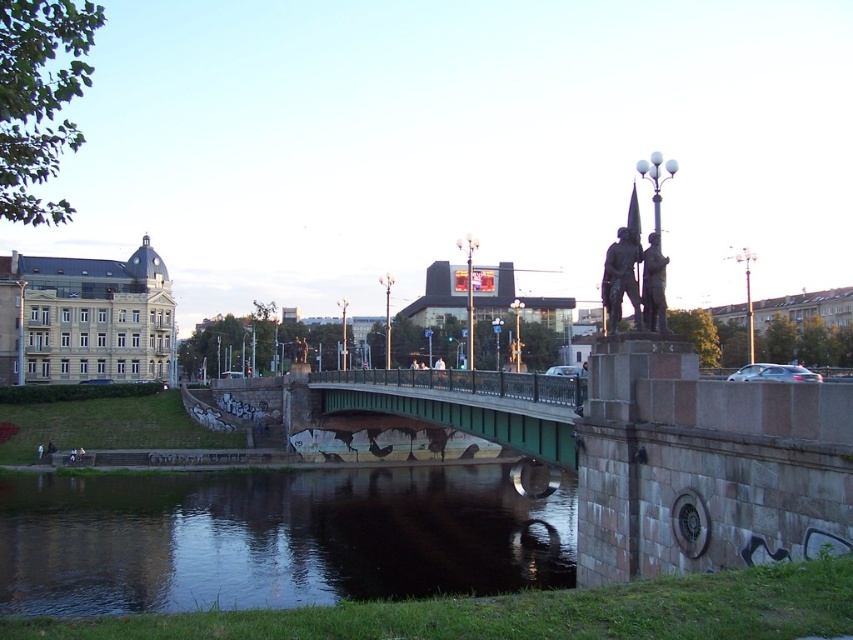
From the picture: You are standing on the bridge and want to take a photo of the dark reflective water at center. Where should you look to capture its reflection?

The dark reflective water at center is located at point [273,538], so you should aim your camera towards that coordinate to capture its reflection.

You are a pedestrian standing on the green painted metal bridge at center. You want to see your reflection in the dark reflective water at center. Is your reflection visible to you?

The dark reflective water at center is positioned under the green painted metal bridge at center, so yes, your reflection would be visible as you stand on the bridge above the water.

You are a photographer planning to capture the reflection of the green painted metal bridge at center in the dark reflective water at center. Based on their heights, will the reflection be fully visible in the water?

The dark reflective water at center has a lesser height compared to green painted metal bridge at center, so the reflection of the green painted metal bridge at center may not be fully visible in the dark reflective water at center because the water is shorter in height than the bridge.